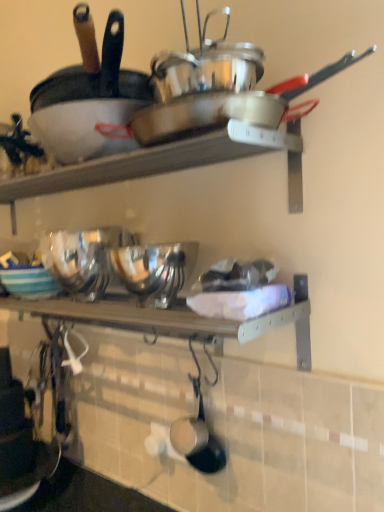
Question: Does shiny silver frying pan at lower center, placed as the 2th frying pan when sorted from top to bottom, have a lesser height compared to striped ceramic bowl at center?

Choices:
 (A) yes
 (B) no

Answer: (B)

Question: Is shiny silver frying pan at lower center, the 1th frying pan ordered from the bottom, further to the viewer compared to striped ceramic bowl at center?

Choices:
 (A) no
 (B) yes

Answer: (A)

Question: Does shiny silver frying pan at lower center, placed as the 2th frying pan when sorted from top to bottom, have a smaller size compared to striped ceramic bowl at center?

Choices:
 (A) no
 (B) yes

Answer: (B)

Question: Can you confirm if shiny silver frying pan at lower center, the 1th frying pan ordered from the bottom, is thinner than striped ceramic bowl at center?

Choices:
 (A) yes
 (B) no

Answer: (A)

Question: Considering the relative positions of shiny silver frying pan at lower center, placed as the 2th frying pan when sorted from top to bottom, and striped ceramic bowl at center in the image provided, is shiny silver frying pan at lower center, placed as the 2th frying pan when sorted from top to bottom, to the right of striped ceramic bowl at center from the viewer's perspective?

Choices:
 (A) yes
 (B) no

Answer: (A)

Question: From the image's perspective, would you say shiny silver frying pan at lower center, the 1th frying pan ordered from the bottom, is shown under striped ceramic bowl at center?

Choices:
 (A) yes
 (B) no

Answer: (A)

Question: Is wooden shelf at center positioned in front of matte black frying pan at upper left, the 1th frying pan from the top?

Choices:
 (A) no
 (B) yes

Answer: (A)

Question: Is wooden shelf at center to the right of matte black frying pan at upper left, arranged as the 2th frying pan when ordered from the bottom, from the viewer's perspective?

Choices:
 (A) no
 (B) yes

Answer: (A)

Question: Does wooden shelf at center have a lesser height compared to matte black frying pan at upper left, arranged as the 2th frying pan when ordered from the bottom?

Choices:
 (A) no
 (B) yes

Answer: (B)

Question: From a real-world perspective, does wooden shelf at center stand above matte black frying pan at upper left, arranged as the 2th frying pan when ordered from the bottom?

Choices:
 (A) no
 (B) yes

Answer: (A)

Question: Does wooden shelf at center have a smaller size compared to matte black frying pan at upper left, arranged as the 2th frying pan when ordered from the bottom?

Choices:
 (A) no
 (B) yes

Answer: (B)

Question: Is wooden shelf at center facing towards matte black frying pan at upper left, the 1th frying pan from the top?

Choices:
 (A) no
 (B) yes

Answer: (A)

Question: Considering the relative positions of shiny silver frying pan at lower center, the 1th frying pan ordered from the bottom, and shiny silver wok at upper center in the image provided, is shiny silver frying pan at lower center, the 1th frying pan ordered from the bottom, in front of shiny silver wok at upper center?

Choices:
 (A) no
 (B) yes

Answer: (A)